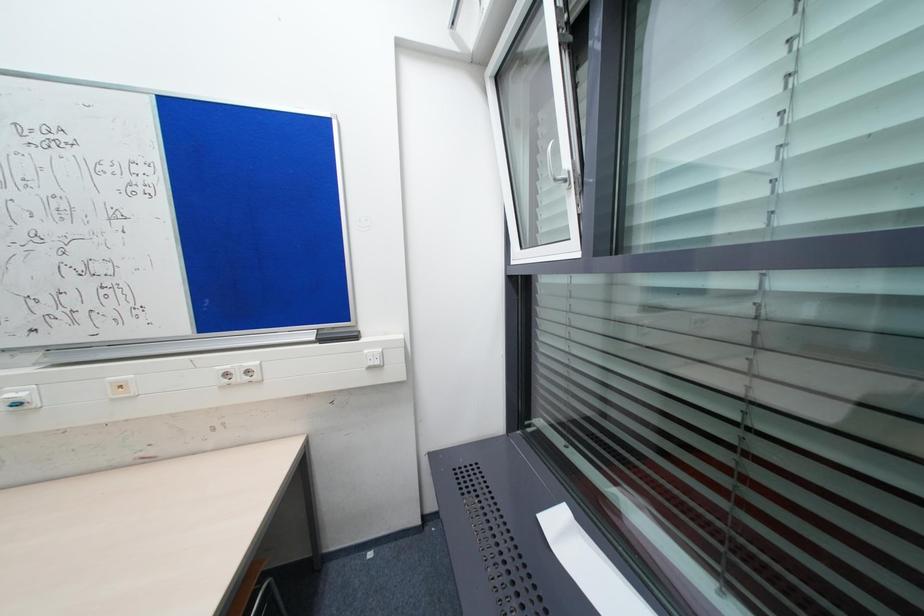
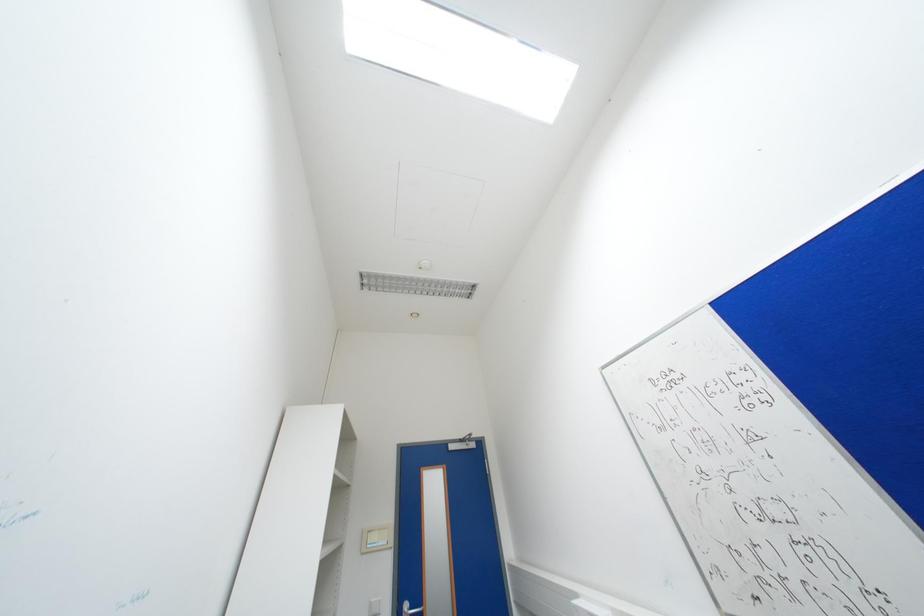
Based on the continuous images, in which direction is the camera rotating?

The camera's rotation is toward left-up.